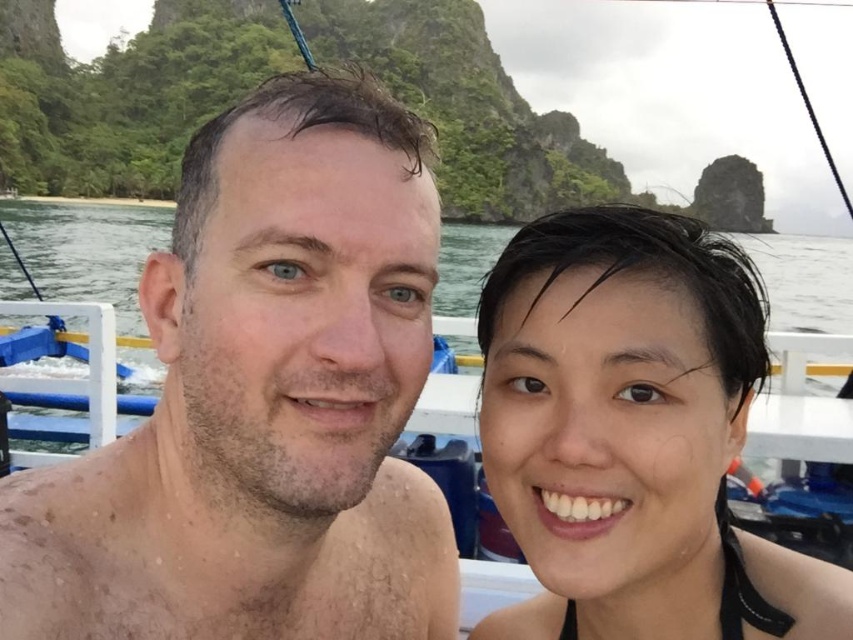
You are a lifeguard at a beach and see two areas of water in the image. The first area has dry skin at center, and the second area has clear blue water at center. Which area would you advise swimmers to avoid due to potential safety risks?

The dry skin at center is thinner than clear blue water at center, so the area with dry skin at center may not be safe for swimming as it might be shallow or have uneven terrain.

You are a photographer trying to capture a closeup of the black matte hair at upper right. The camera you are using has a focal length of 50mm. The point at coordinates point (633, 435) is where you want to focus. Is this point on the black matte hair at upper right?

Yes, the point at coordinates point (633, 435) is on the black matte hair at upper right according to the description.

Based on the photo, you are a photographer trying to capture the dry skin at center and the black matte hair at upper right in a single frame. Based on their positions, which object is located to the left of the other?

The dry skin at center is positioned on the left side of black matte hair at upper right.